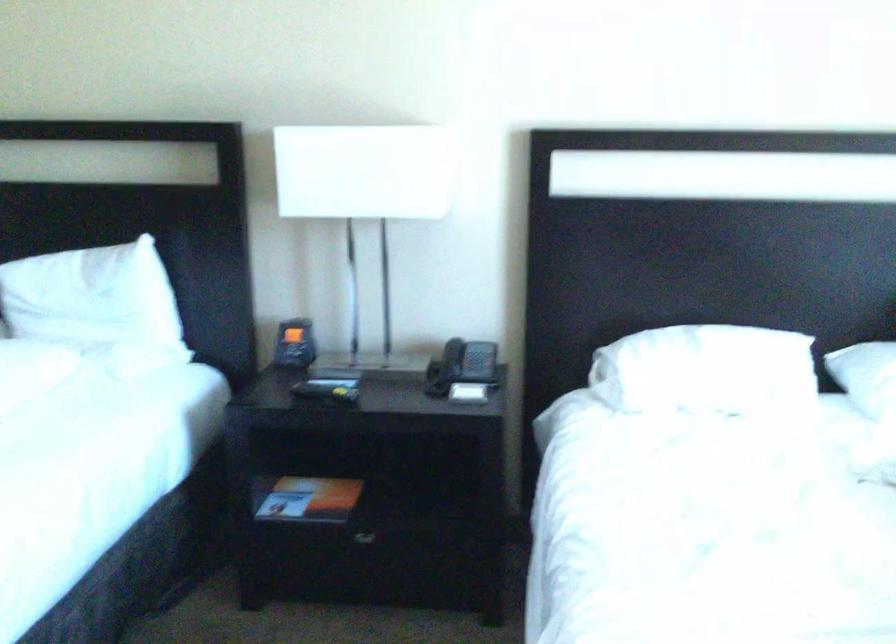
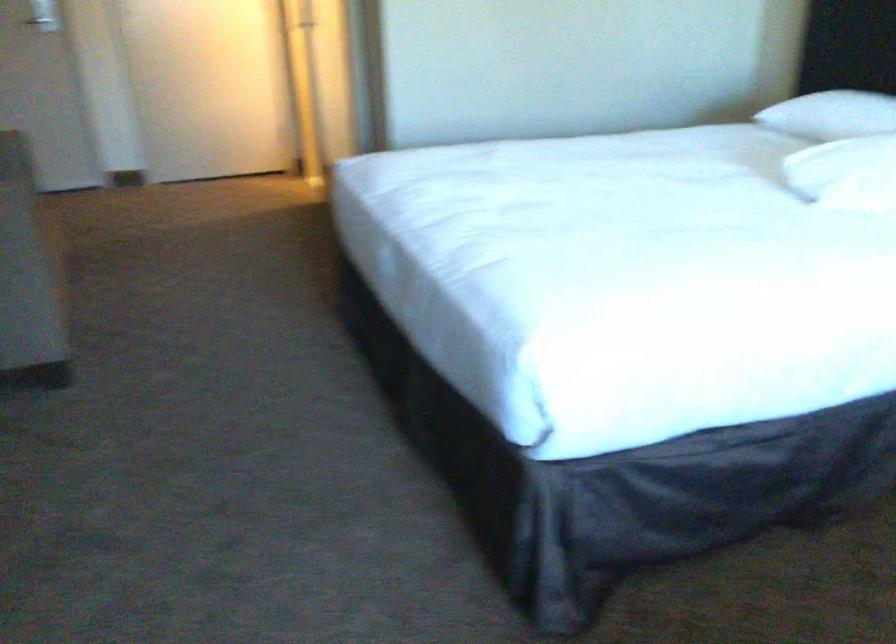
The first image is from the beginning of the video and the second image is from the end. How did the camera likely rotate when shooting the video?

The camera's rotation is toward left-down.